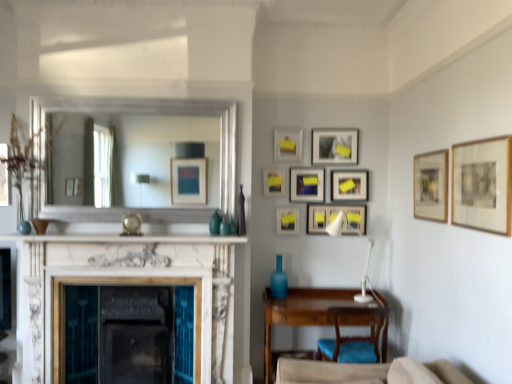
Question: From a real-world perspective, is white plastic lamp at center-right under matte black picture frame at center, which is the first picture frame from back to front?

Choices:
 (A) no
 (B) yes

Answer: (B)

Question: From the image's perspective, is white plastic lamp at center-right under matte black picture frame at center, positioned as the 9th picture frame in front-to-back order?

Choices:
 (A) no
 (B) yes

Answer: (B)

Question: Can you confirm if white plastic lamp at center-right is positioned to the left of matte black picture frame at center, which is the first picture frame from back to front?

Choices:
 (A) no
 (B) yes

Answer: (A)

Question: Considering the relative sizes of white plastic lamp at center-right and matte black picture frame at center, positioned as the 9th picture frame in front-to-back order, in the image provided, is white plastic lamp at center-right bigger than matte black picture frame at center, positioned as the 9th picture frame in front-to-back order,?

Choices:
 (A) no
 (B) yes

Answer: (B)

Question: Does white plastic lamp at center-right have a lesser height compared to matte black picture frame at center, positioned as the 9th picture frame in front-to-back order?

Choices:
 (A) no
 (B) yes

Answer: (A)

Question: Is the position of white plastic lamp at center-right more distant than that of matte black picture frame at center, positioned as the 9th picture frame in front-to-back order?

Choices:
 (A) yes
 (B) no

Answer: (B)

Question: Does matte wooden picture frame at center, the 4th picture frame from the front, have a lesser width compared to matte black picture frame at center, which is the first picture frame from back to front?

Choices:
 (A) no
 (B) yes

Answer: (A)

Question: Is matte black picture frame at center, positioned as the 9th picture frame in front-to-back order, surrounded by matte wooden picture frame at center, arranged as the 6th picture frame when viewed from the back?

Choices:
 (A) yes
 (B) no

Answer: (B)

Question: Is matte wooden picture frame at center, arranged as the 6th picture frame when viewed from the back, far from matte black picture frame at center, positioned as the 9th picture frame in front-to-back order?

Choices:
 (A) yes
 (B) no

Answer: (B)

Question: Is matte wooden picture frame at center, the 4th picture frame from the front, in contact with matte black picture frame at center, which is the first picture frame from back to front?

Choices:
 (A) yes
 (B) no

Answer: (B)

Question: Is the position of matte wooden picture frame at center, arranged as the 6th picture frame when viewed from the back, more distant than that of matte black picture frame at center, which is the first picture frame from back to front?

Choices:
 (A) no
 (B) yes

Answer: (A)

Question: Can you confirm if matte wooden picture frame at center, arranged as the 6th picture frame when viewed from the back, is bigger than matte black picture frame at center, which is the first picture frame from back to front?

Choices:
 (A) yes
 (B) no

Answer: (A)

Question: Considering the relative sizes of silver/metallic mirror at upper center and matte black picture frame at center, positioned as the 9th picture frame in front-to-back order, in the image provided, is silver/metallic mirror at upper center shorter than matte black picture frame at center, positioned as the 9th picture frame in front-to-back order,?

Choices:
 (A) yes
 (B) no

Answer: (B)